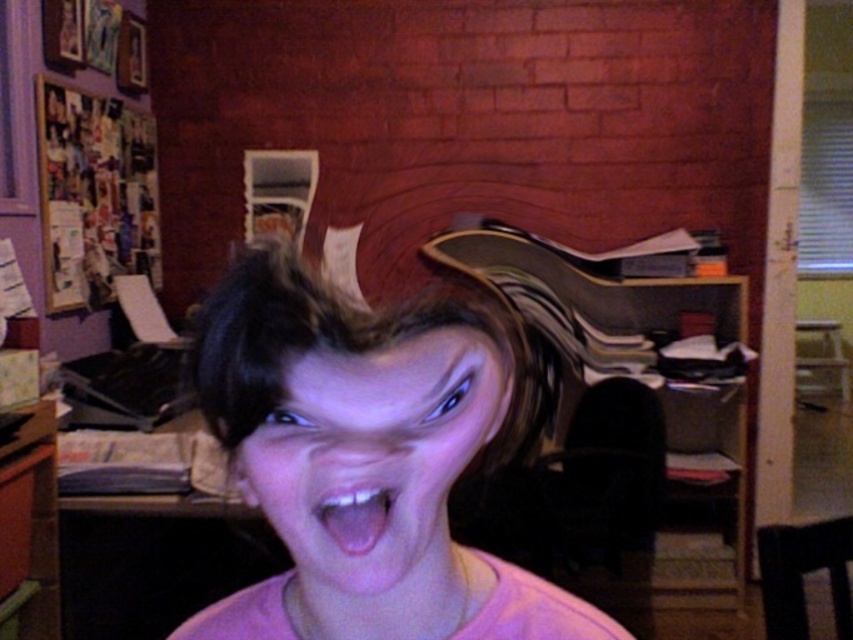
Question: Does pink matte hair at center have a greater width compared to pink matte face at center?

Choices:
 (A) yes
 (B) no

Answer: (A)

Question: Which of the following is the farthest from the observer?

Choices:
 (A) pink glossy tongue at center
 (B) pink matte hair at center
 (C) pink matte face at center

Answer: (B)

Question: Does pink matte hair at center have a larger size compared to pink glossy tongue at center?

Choices:
 (A) yes
 (B) no

Answer: (A)

Question: Is pink matte hair at center smaller than pink glossy tongue at center?

Choices:
 (A) no
 (B) yes

Answer: (A)

Question: Which of the following is the closest to the observer?

Choices:
 (A) (358, 488)
 (B) (300, 556)
 (C) (399, 605)

Answer: (A)

Question: Which point appears closest to the camera in this image?

Choices:
 (A) (280, 500)
 (B) (403, 448)

Answer: (B)